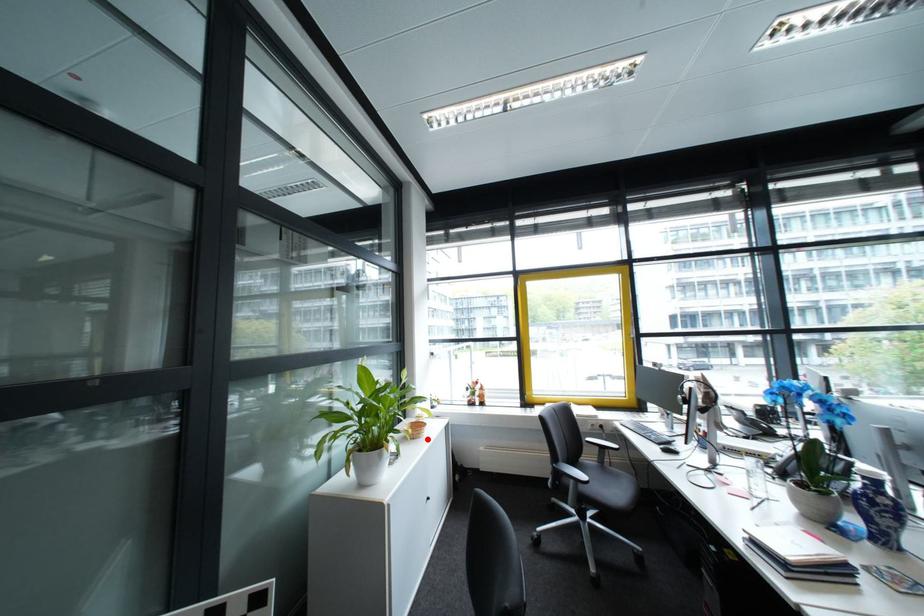
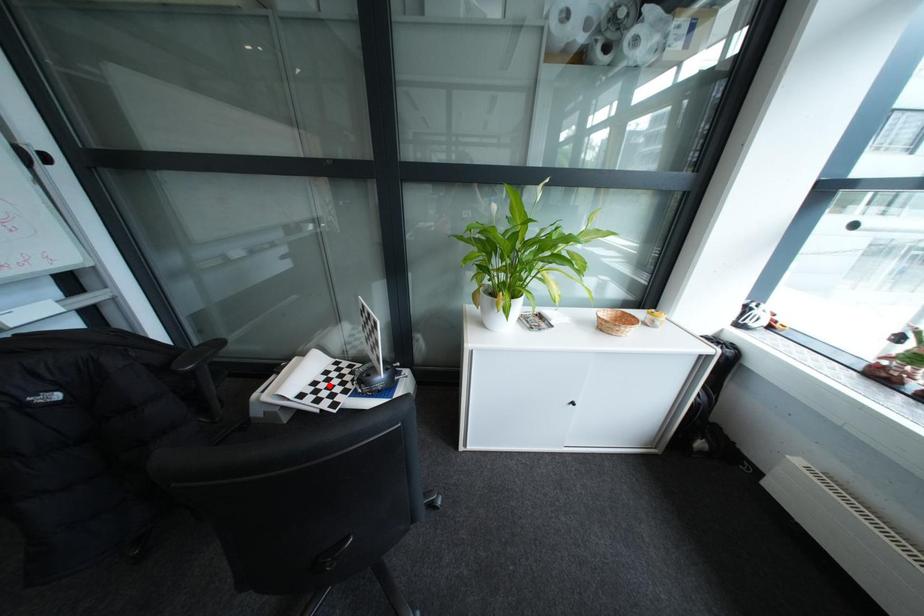
I am providing you with two images of the same scene from different viewpoints. A red point is marked on the first image and another point is marked on the second image. Is the marked point in image1 the same physical position as the marked point in image2?

No